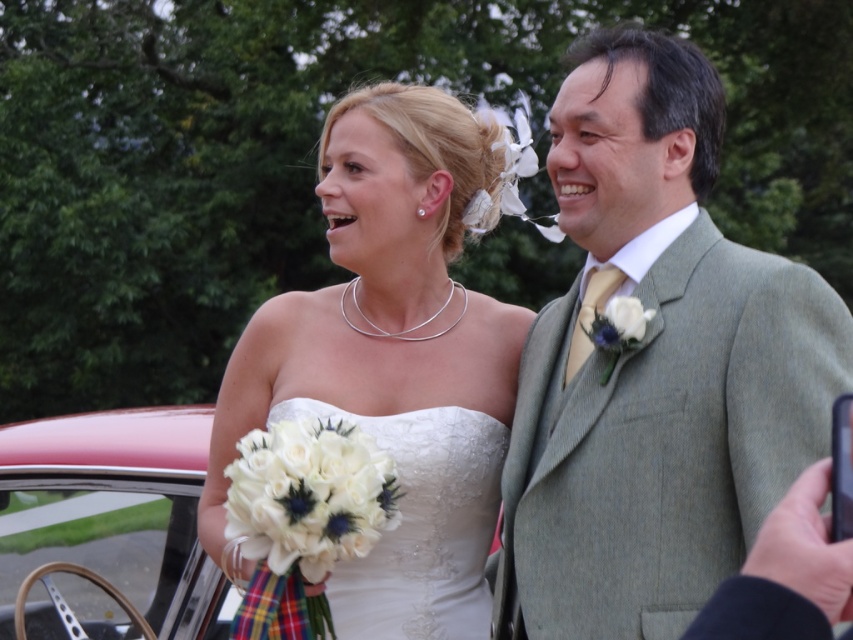
Question: Is light gray textured suit at center closer to the viewer compared to white lace dress at center?

Choices:
 (A) yes
 (B) no

Answer: (A)

Question: Among these objects, which one is farthest from the camera?

Choices:
 (A) light gray textured suit at center
 (B) white satin dress at center

Answer: (B)

Question: Which point is farther to the camera?

Choices:
 (A) white lace dress at center
 (B) white satin dress at center
 (C) light gray textured suit at center

Answer: (A)

Question: Where is light gray textured suit at center located in relation to white lace dress at center in the image?

Choices:
 (A) above
 (B) below

Answer: (A)

Question: Is light gray textured suit at center closer to camera compared to white satin dress at center?

Choices:
 (A) no
 (B) yes

Answer: (B)

Question: Which object is the farthest from the white satin dress at center?

Choices:
 (A) light gray textured suit at center
 (B) white lace dress at center

Answer: (A)